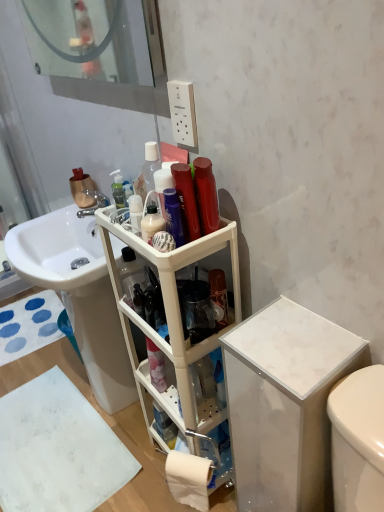
Question: Does pink matte spray can at center, which is counted as the fourth toiletry, starting from the front, have a greater width compared to white glossy sink at center?

Choices:
 (A) yes
 (B) no

Answer: (B)

Question: Is white glossy sink at center a part of pink matte spray can at center, arranged as the 1th toiletry when ordered from the bottom?

Choices:
 (A) no
 (B) yes

Answer: (A)

Question: Is pink matte spray can at center, placed as the first toiletry when sorted from back to front, positioned in front of white glossy sink at center?

Choices:
 (A) yes
 (B) no

Answer: (B)

Question: Is pink matte spray can at center, the 4th toiletry from the top, located outside white glossy sink at center?

Choices:
 (A) yes
 (B) no

Answer: (A)

Question: Can you confirm if pink matte spray can at center, which is counted as the fourth toiletry, starting from the front, is thinner than white glossy sink at center?

Choices:
 (A) yes
 (B) no

Answer: (A)

Question: From the image's perspective, is white matte toilet paper at lower center located above or below white marble cabinet at right, which ranks as the first cabinetry in right-to-left order?

Choices:
 (A) below
 (B) above

Answer: (A)

Question: In terms of size, does white matte toilet paper at lower center appear bigger or smaller than white marble cabinet at right, arranged as the second cabinetry when viewed from the left?

Choices:
 (A) small
 (B) big

Answer: (A)

Question: Does point (203, 501) appear closer or farther from the camera than point (283, 304)?

Choices:
 (A) closer
 (B) farther

Answer: (A)

Question: Is white matte toilet paper at lower center wider or thinner than white marble cabinet at right, arranged as the second cabinetry when viewed from the left?

Choices:
 (A) wide
 (B) thin

Answer: (B)

Question: Is white matte bath mat at lower left, which ranks as the first bath mat in front-to-back order, to the left or to the right of white glossy sink at center in the image?

Choices:
 (A) right
 (B) left

Answer: (B)

Question: From a real-world perspective, is white matte bath mat at lower left, positioned as the 2th bath mat in back-to-front order, positioned above or below white glossy sink at center?

Choices:
 (A) above
 (B) below

Answer: (B)

Question: Which is correct: white matte bath mat at lower left, marked as the 2th bath mat in a top-to-bottom arrangement, is inside white glossy sink at center, or outside of it?

Choices:
 (A) inside
 (B) outside

Answer: (B)

Question: From the image's perspective, is white matte bath mat at lower left, marked as the 2th bath mat in a top-to-bottom arrangement, above or below white glossy sink at center?

Choices:
 (A) below
 (B) above

Answer: (A)

Question: Relative to metallic silver faucet at sink left, is white fabric bath mat at lower left, which is the 2th bath mat in front-to-back order, in front or behind?

Choices:
 (A) front
 (B) behind

Answer: (B)

Question: Considering the positions of white fabric bath mat at lower left, the 2th bath mat from the bottom, and metallic silver faucet at sink left in the image, is white fabric bath mat at lower left, the 2th bath mat from the bottom, taller or shorter than metallic silver faucet at sink left?

Choices:
 (A) tall
 (B) short

Answer: (B)